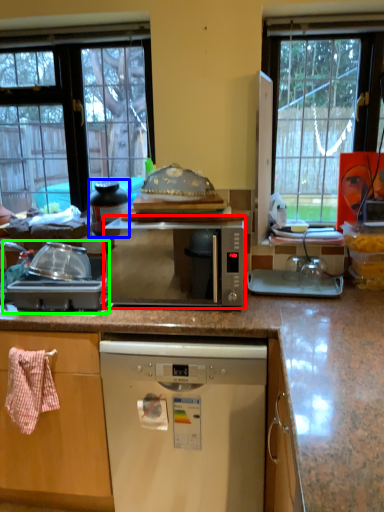
Question: Which is nearer to the microwave oven (highlighted by a red box)? appliance (highlighted by a blue box) or appliance (highlighted by a green box).

Choices:
 (A) appliance
 (B) appliance

Answer: (B)